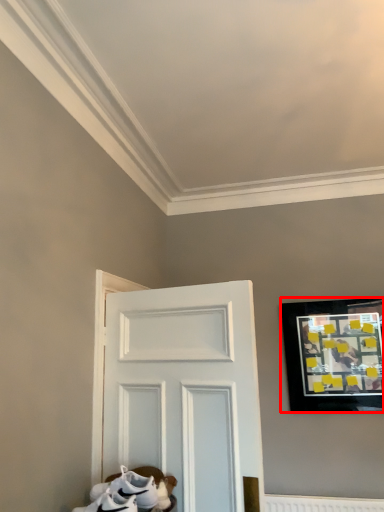
Question: Considering the relative positions of picture frame (annotated by the red box) and footwear in the image provided, where is picture frame (annotated by the red box) located with respect to the staircase?

Choices:
 (A) right
 (B) left

Answer: (A)